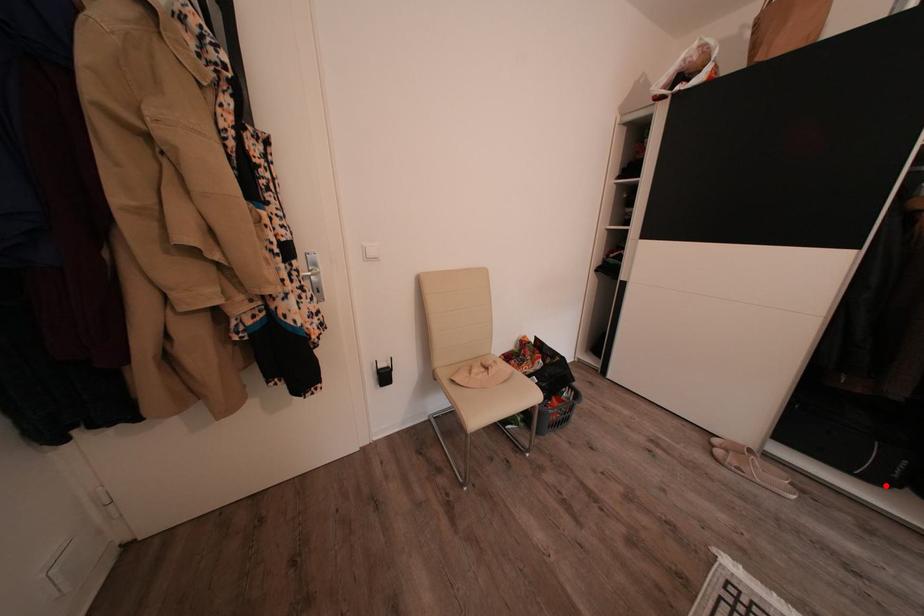
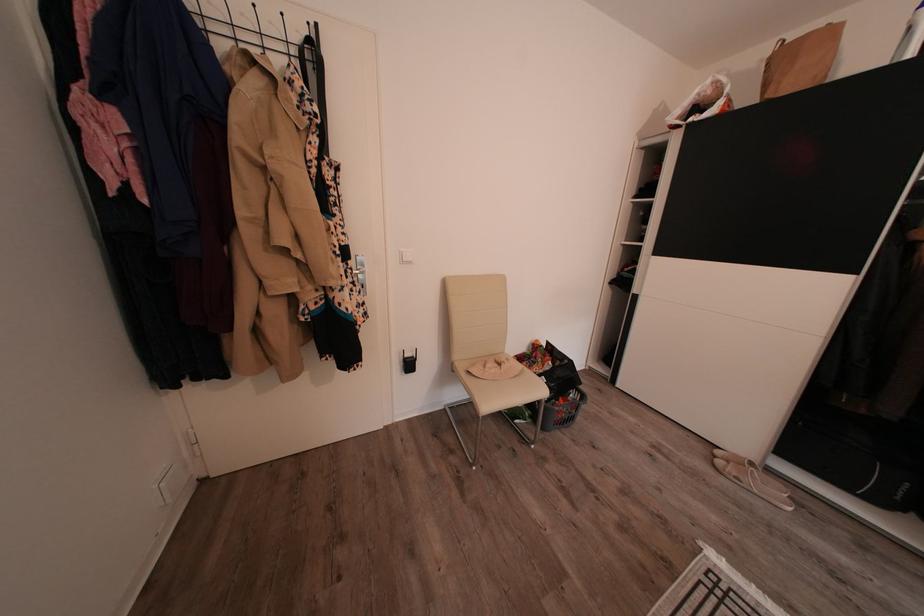
Question: I am providing you with two images of the same scene from different viewpoints. Image1 has a red point marked. In image2, the corresponding 3D location appears at what relative position? Reply with the corresponding letter.

Choices:
 (A) Closer
 (B) Farther

Answer: (B)